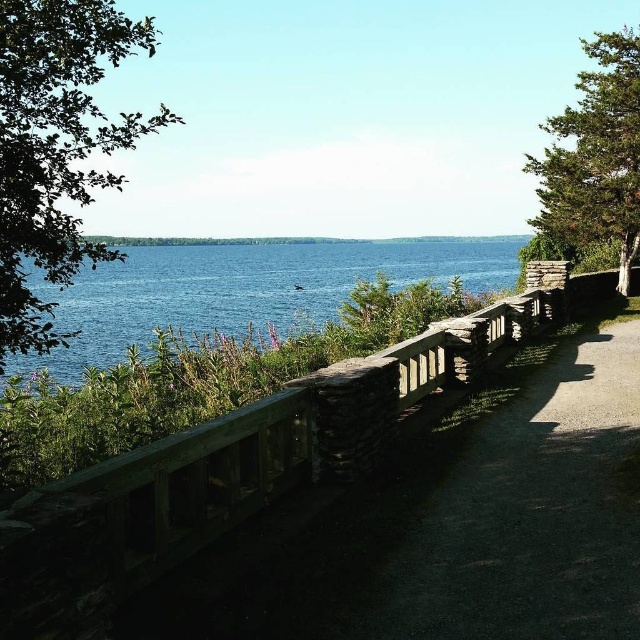
You are planning to take a photo of the wooden path at center and the blue water at center. Which object will occupy more area in your photo?

The blue water at center occupies more area in the photo because the wooden path at center occupies less space than blue water at center.

You are standing on the wooden path at center and want to take a photo of the green leafy tree at upper left. Which direction should you face to ensure the tree is in the frame?

You should face upward and to the left because the green leafy tree at upper left is positioned above and to the left of the wooden path at center.